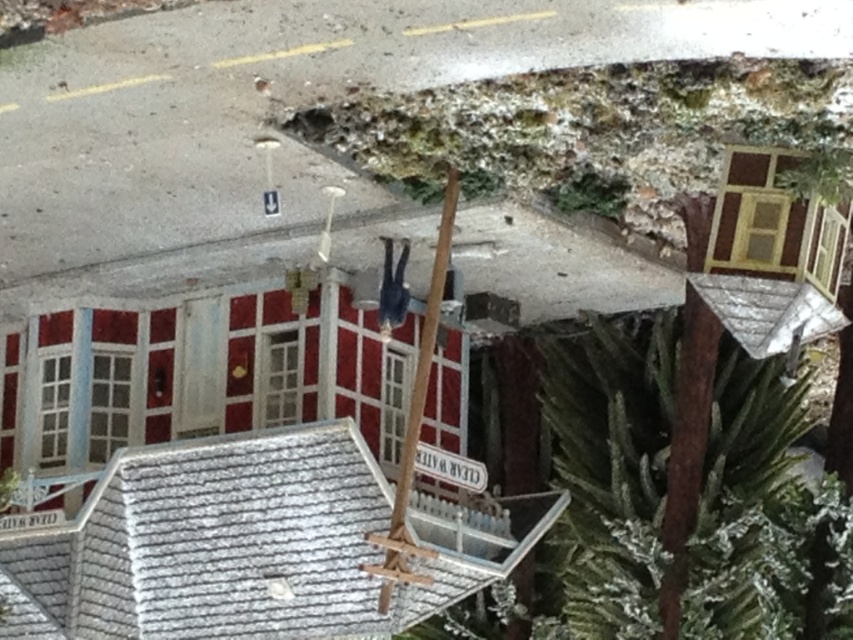
Question: Which object is closer to the camera taking this photo?

Choices:
 (A) green mossy tree trunk at upper center
 (B) green textured pine tree at center right

Answer: (A)

Question: Which object is closer to the camera taking this photo?

Choices:
 (A) green mossy tree trunk at upper center
 (B) green textured pine tree at center right

Answer: (A)

Question: Which point is farther to the camera?

Choices:
 (A) (579, 198)
 (B) (689, 604)

Answer: (B)

Question: Is green mossy tree trunk at upper center positioned behind green textured pine tree at center right?

Choices:
 (A) yes
 (B) no

Answer: (B)

Question: Can you confirm if green mossy tree trunk at upper center is wider than green textured pine tree at center right?

Choices:
 (A) yes
 (B) no

Answer: (A)

Question: Does green mossy tree trunk at upper center have a larger size compared to green textured pine tree at center right?

Choices:
 (A) no
 (B) yes

Answer: (A)